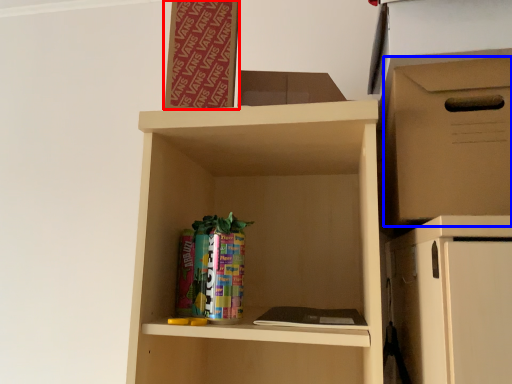
Question: Which point is further to the camera, bulletin board (highlighted by a red box) or storage box (highlighted by a blue box)?

Choices:
 (A) bulletin board
 (B) storage box

Answer: (A)